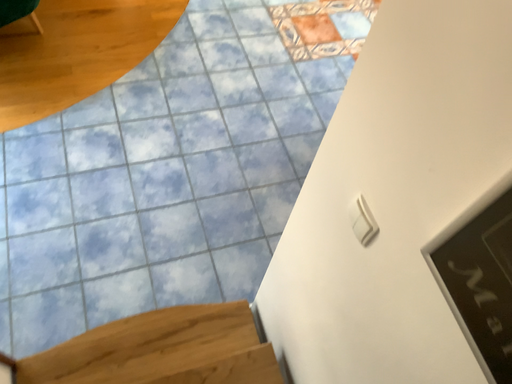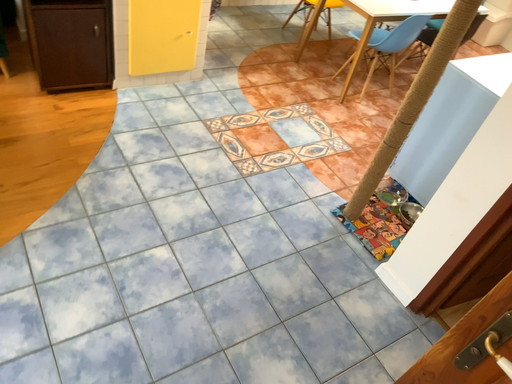
Question: How did the camera likely rotate when shooting the video?

Choices:
 (A) rotated right
 (B) rotated left

Answer: (A)